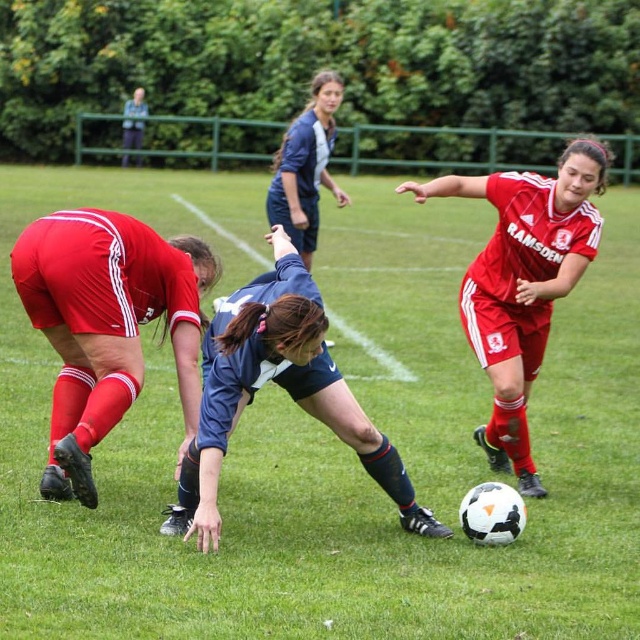
Can you confirm if green grass football field at center is shorter than matte red shorts at lower left?

In fact, green grass football field at center may be taller than matte red shorts at lower left.

Which is in front, point (164, 230) or point (179, 316)?

Positioned in front is point (179, 316).

Locate an element on the screen. green grass football field at center is located at coordinates (332, 442).

Who is taller, green grass football field at center or navy blue jersey at center?

green grass football field at center is taller.

Which is more to the left, green grass football field at center or navy blue jersey at center?

Positioned to the left is navy blue jersey at center.

The image size is (640, 640). Describe the element at coordinates (332, 442) in the screenshot. I see `green grass football field at center` at that location.

At what (x,y) coordinates should I click in order to perform the action: click on green grass football field at center. Please return your answer as a coordinate pair (x, y). Image resolution: width=640 pixels, height=640 pixels. Looking at the image, I should click on (332, 442).

Does matte red shorts at lower left appear under navy blue jersey at center?

No.

Can you confirm if matte red shorts at lower left is positioned to the left of navy blue jersey at center?

Indeed, matte red shorts at lower left is positioned on the left side of navy blue jersey at center.

The image size is (640, 640). I want to click on matte red shorts at lower left, so click(x=106, y=324).

Where is `matte red shorts at lower left`? The image size is (640, 640). matte red shorts at lower left is located at coordinates (106, 324).